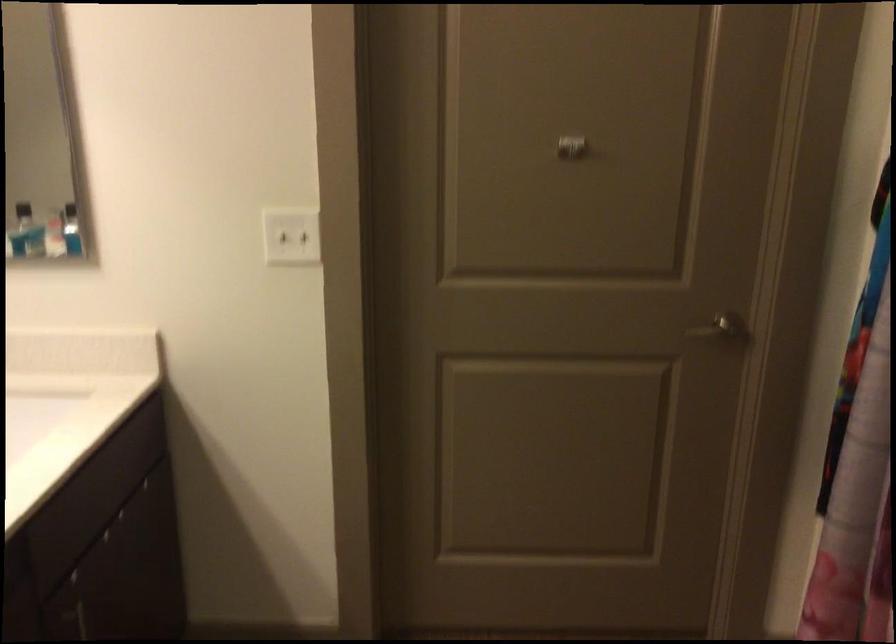
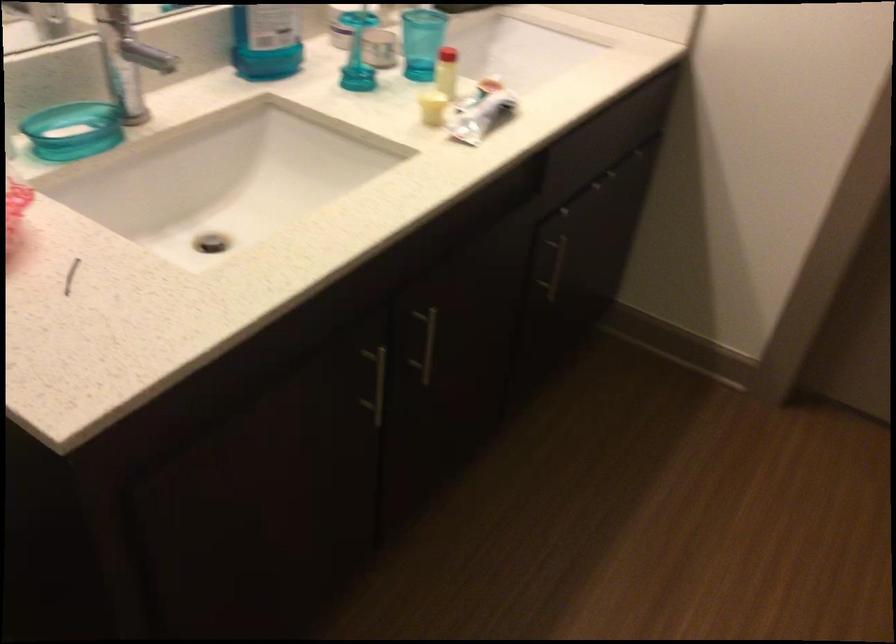
Based on the continuous images, in which direction is the camera rotating?

The camera rotated toward left-down.